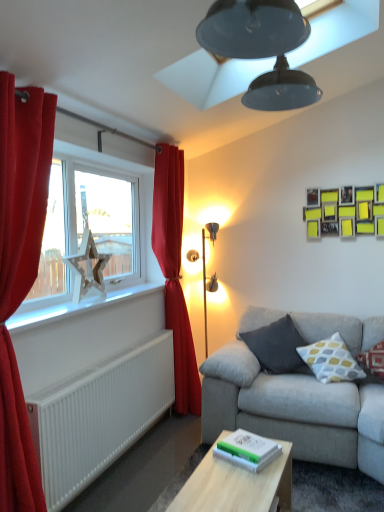
Identify the location of free point above light wood rectangular table at center (from a real-world perspective). This screenshot has height=512, width=384. [240, 485].